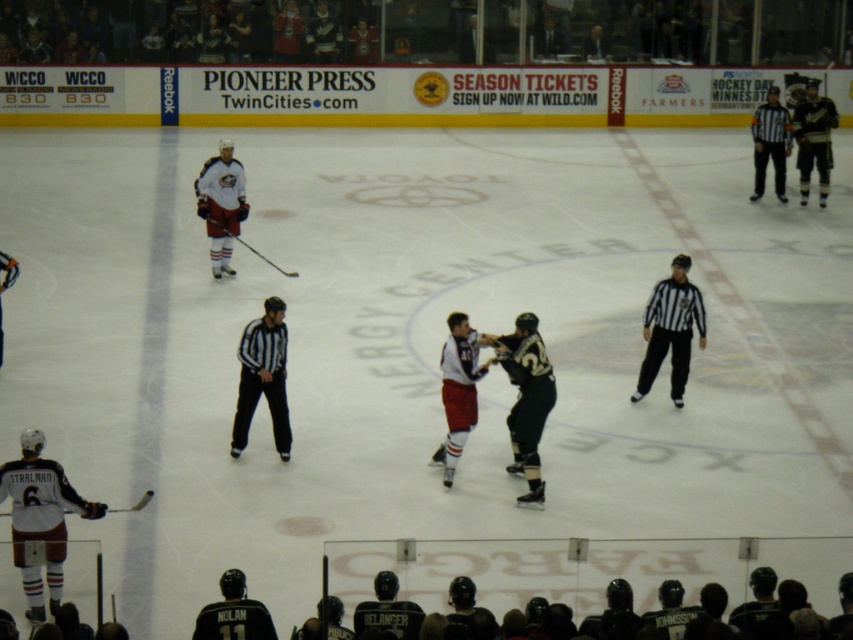
Question: Does black jersey at center appear on the right side of white matte jersey at center?

Choices:
 (A) no
 (B) yes

Answer: (B)

Question: Which point appears farthest from the camera in this image?

Choices:
 (A) (196, 205)
 (B) (16, 275)
 (C) (514, 461)

Answer: (A)

Question: Among these points, which one is nearest to the camera?

Choices:
 (A) 233,236
 (B) 0,356
 (C) 753,196
 (D) 132,508

Answer: (D)

Question: Does white jersey at center appear on the right side of black striped shirt at upper right?

Choices:
 (A) yes
 (B) no

Answer: (B)

Question: Can you confirm if black striped shirt at center is smaller than matte black hockey stick at center?

Choices:
 (A) no
 (B) yes

Answer: (B)

Question: Which object appears farthest from the camera in this image?

Choices:
 (A) striped jersey official at center
 (B) matte black hockey stick at center
 (C) black jersey at center

Answer: (B)